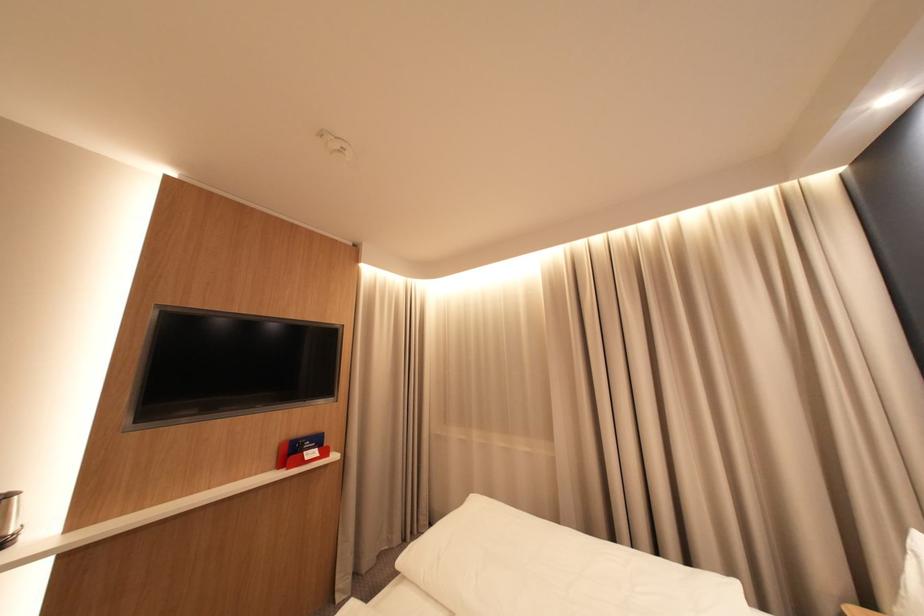
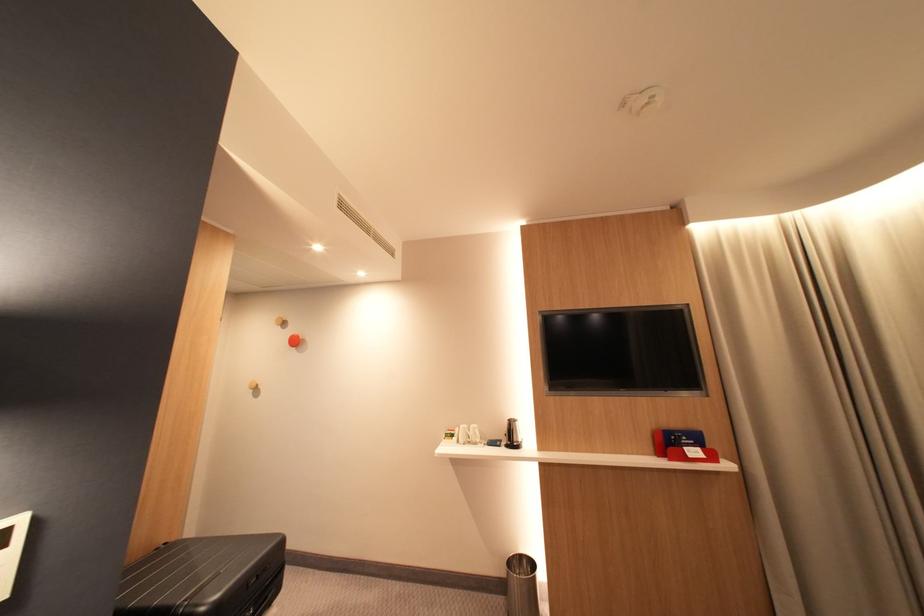
Find the pixel in the second image that matches [314,455] in the first image.

(696, 450)